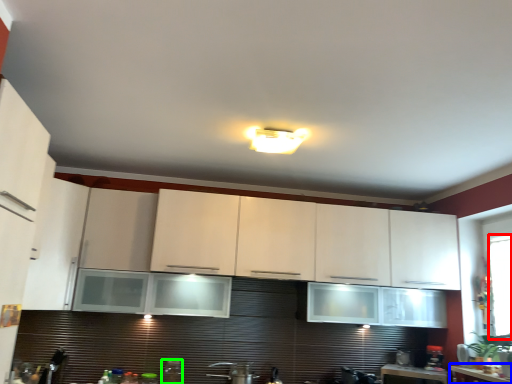
Question: Which is farther away from window screen (highlighted by a red box)? counter top (highlighted by a blue box) or appliance (highlighted by a green box)?

Choices:
 (A) counter top
 (B) appliance

Answer: (B)